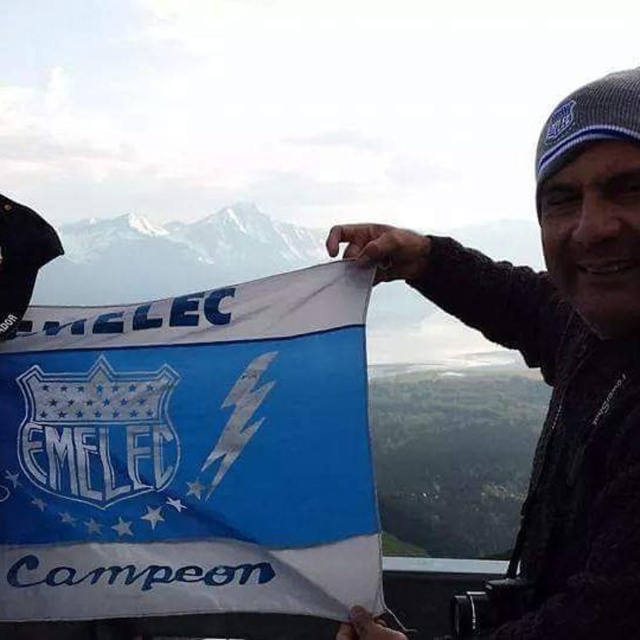
You are an artist trying to sketch this scene. You notice the blue fabric flag at center and the knitted wool beanie at upper right. Which object should you draw first if you want to focus on the larger one?

The knitted wool beanie at upper right should be drawn first because it occupies more space than the blue fabric flag at center according to the description.

In the scene shown: You are standing in front of the flag and need to determine its position relative to the mountains in the background. According to the scene description, where is the blue fabric flag at center positioned in relation to the mountains?

The blue fabric flag at center is located at point (189, 454), which places it in the foreground, closer to the viewer than the snow capped mountains in the background.

Based on the photo, you are a photographer trying to capture the blue fabric flag at center and the knitted wool beanie at upper right in the same frame. Based on their sizes, which object would appear smaller in the photo?

The blue fabric flag at center appears smaller in the photo because it is not as tall as the knitted wool beanie at upper right.